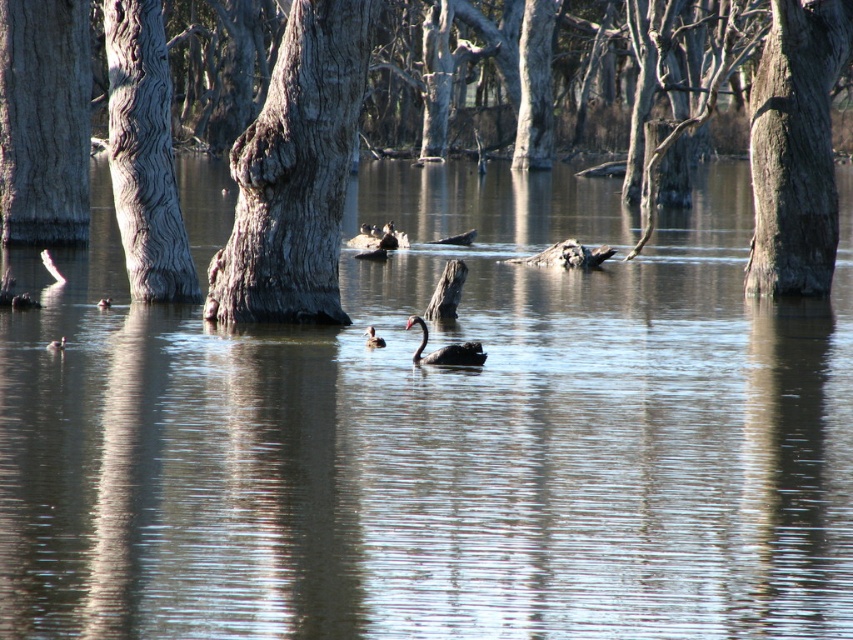
You are a wildlife photographer aiming to capture both the black glossy duck at center and the brown matte duck at center in a single frame. Given their sizes, which duck should you focus on first to ensure both fit in the shot?

The black glossy duck at center is larger in size than the brown matte duck at center, so you should focus on positioning the larger black glossy duck at center first to ensure there is enough space for both in the frame.

You are a photographer trying to capture both the black glossy duck at center and the brown matte duck at center in a single shot. Since you want to highlight their height difference, which duck should you position closer to the center of the frame to emphasize its greater height?

The black glossy duck at center is taller than the brown matte duck at center, so positioning the black glossy duck at center closer to the center of the frame will emphasize its greater height.

You are a kayaker planning to paddle between the brown wood tree at center and the gray textured tree trunk at center. Given that your kayak is 3 meters long, will there be enough space to pass through the gap between them?

The gap between the brown wood tree at center and the gray textured tree trunk at center is 8.96 meters. Since your kayak is only 3 meters long, there is more than enough space to safely pass through the gap between them.